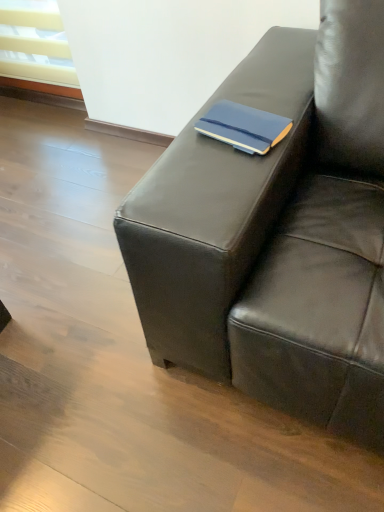
What do you see at coordinates (277, 232) in the screenshot? I see `matte black couch at center` at bounding box center [277, 232].

I want to click on matte black couch at center, so click(277, 232).

What is the approximate height of matte blue notebook at center?

It is 0.91 inches.

The height and width of the screenshot is (512, 384). What do you see at coordinates (243, 127) in the screenshot?
I see `matte blue notebook at center` at bounding box center [243, 127].

Where is `matte blue notebook at center`? matte blue notebook at center is located at coordinates (243, 127).

The width and height of the screenshot is (384, 512). In order to click on matte black couch at center in this screenshot , I will do `click(277, 232)`.

Does matte blue notebook at center appear on the left side of matte black couch at center?

Yes, matte blue notebook at center is to the left of matte black couch at center.

Which object is more forward, matte blue notebook at center or matte black couch at center?

matte black couch at center is in front.

Considering the positions of point (273, 122) and point (352, 53), is point (273, 122) closer or farther from the camera than point (352, 53)?

Point (273, 122) appears to be closer to the viewer than point (352, 53).

From the image's perspective, which is below, matte blue notebook at center or matte black couch at center?

matte black couch at center is shown below in the image.

From a real-world perspective, is matte blue notebook at center located higher than matte black couch at center?

Yes.

Which of these two, matte blue notebook at center or matte black couch at center, is thinner?

With smaller width is matte blue notebook at center.

Between matte blue notebook at center and matte black couch at center, which one has more height?

matte black couch at center.

Considering the sizes of matte blue notebook at center and matte black couch at center in the image, is matte blue notebook at center bigger or smaller than matte black couch at center?

matte blue notebook at center is smaller than matte black couch at center.

Is matte blue notebook at center not inside matte black couch at center?

Yes, matte blue notebook at center is not within matte black couch at center.

Would you consider matte blue notebook at center to be distant from matte black couch at center?

matte blue notebook at center is near matte black couch at center, not far away.

Is matte blue notebook at center aimed at matte black couch at center?

No, matte blue notebook at center is not oriented towards matte black couch at center.

How many degrees apart are the facing directions of matte blue notebook at center and matte black couch at center?

matte blue notebook at center and matte black couch at center are facing 10.8 degrees away from each other.

Find the location of a particular element. The height and width of the screenshot is (512, 384). studio couch that appears in front of the matte blue notebook at center is located at coordinates (277, 232).

In the scene shown: In the image, is matte black couch at center on the left side or the right side of matte blue notebook at center?

From the image, it's evident that matte black couch at center is to the right of matte blue notebook at center.

In the image, is matte black couch at center positioned in front of or behind matte blue notebook at center?

Clearly, matte black couch at center is in front of matte blue notebook at center.

Does point (176, 157) come in front of point (219, 138)?

Yes, it is.

From the image's perspective, between matte black couch at center and matte blue notebook at center, which one is located above?

matte blue notebook at center appears higher in the image.

From a real-world perspective, is matte black couch at center located beneath matte blue notebook at center?

Yes, from a real-world perspective, matte black couch at center is beneath matte blue notebook at center.

Can you confirm if matte black couch at center is wider than matte blue notebook at center?

Yes.

Is matte black couch at center taller than matte blue notebook at center?

Indeed, matte black couch at center has a greater height compared to matte blue notebook at center.

Between matte black couch at center and matte blue notebook at center, which one has larger size?

matte black couch at center.

Is matte blue notebook at center located within matte black couch at center?

That's incorrect, matte blue notebook at center is not inside matte black couch at center.

Is matte black couch at center not near matte blue notebook at center?

matte black couch at center is near matte blue notebook at center, not far away.

Is matte black couch at center oriented away from matte blue notebook at center?

No, matte black couch at center's orientation is not away from matte blue notebook at center.

Can you tell me how much matte black couch at center and matte blue notebook at center differ in facing direction?

10.8 degrees separate the facing orientations of matte black couch at center and matte blue notebook at center.

Locate an element on the screen. paperback book above the matte black couch at center (from the image's perspective) is located at coordinates (243, 127).

Find the location of a particular element. studio couch that is below the matte blue notebook at center (from the image's perspective) is located at coordinates (277, 232).

You are a GUI agent. You are given a task and a screenshot of the screen. Output one action in this format:
    pyautogui.click(x=<x>, y=<y>)
    Task: Click on the paperback book located above the matte black couch at center (from a real-world perspective)
    Image resolution: width=384 pixels, height=512 pixels.
    Given the screenshot: What is the action you would take?
    pyautogui.click(x=243, y=127)